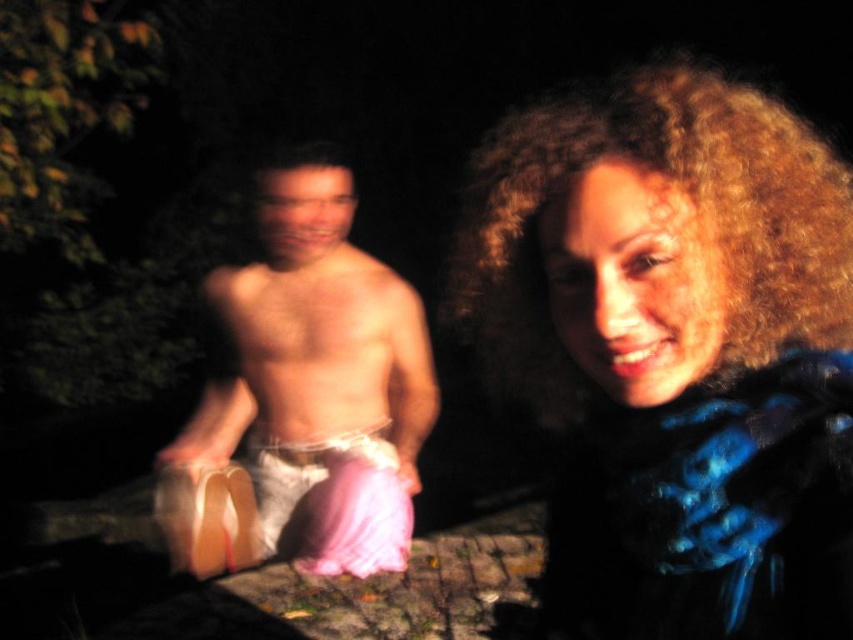
You are a photographer setting up a shot in a dark outdoor scene. You notice two elements in your frame, the curly blonde hair at right and the pink satin underwear at lower left. Based on their positions, which object would appear larger in your photo?

The curly blonde hair at right would appear larger in the photo because it is much taller than the pink satin underwear at lower left.

You are a photographer trying to capture the scene. You notice the curly blonde hair at right and the pink satin underwear at lower left. Which object is positioned higher in the frame?

The curly blonde hair at right is located above the pink satin underwear at lower left, so it is positioned higher in the frame.